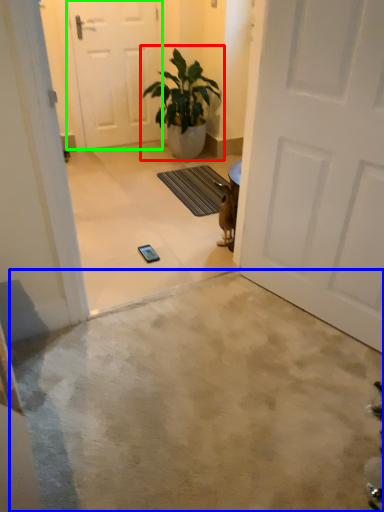
Question: Based on their relative distances, which object is farther from houseplant (highlighted by a red box)? Choose from concrete (highlighted by a blue box) and door (highlighted by a green box).

Choices:
 (A) concrete
 (B) door

Answer: (A)